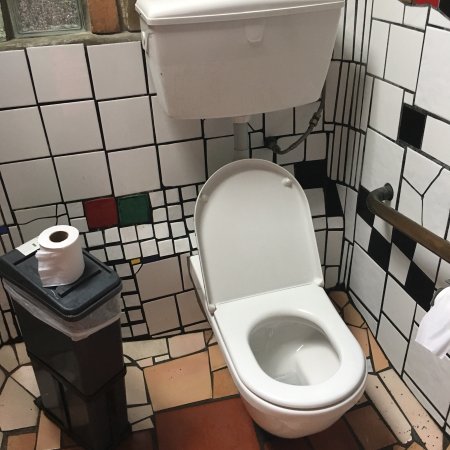
Image resolution: width=450 pixels, height=450 pixels. Identify the location of window. [x=66, y=23].